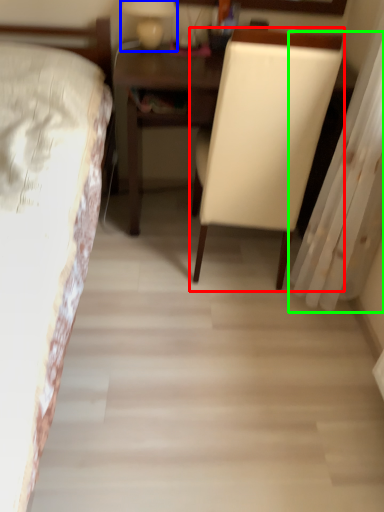
Question: Which is nearer to the chair (highlighted by a red box)? bedside lamp (highlighted by a blue box) or curtain (highlighted by a green box).

Choices:
 (A) bedside lamp
 (B) curtain

Answer: (B)